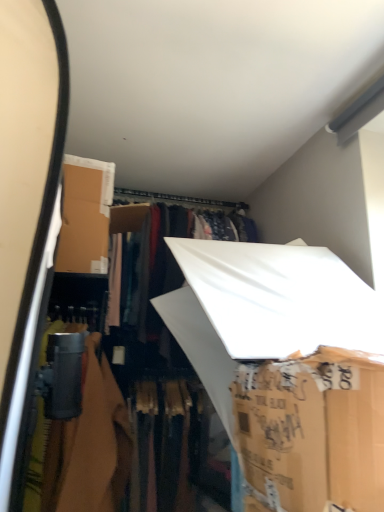
Question: Is white cardboard box at lower right, which is the first storage box in front-to-back order, placed right next to white cardboard box at center, which ranks as the 1th storage box in back-to-front order?

Choices:
 (A) no
 (B) yes

Answer: (A)

Question: Is white cardboard box at lower right, which is the first storage box in front-to-back order, smaller than white cardboard box at center, which is the 2th storage box from front to back?

Choices:
 (A) yes
 (B) no

Answer: (A)

Question: Is white cardboard box at center, which ranks as the 1th storage box in back-to-front order, completely or partially inside white cardboard box at lower right, which is the first storage box in front-to-back order?

Choices:
 (A) no
 (B) yes

Answer: (A)

Question: Considering the relative sizes of white cardboard box at lower right, acting as the 2th storage box starting from the back, and white cardboard box at center, which ranks as the 1th storage box in back-to-front order, in the image provided, is white cardboard box at lower right, acting as the 2th storage box starting from the back, taller than white cardboard box at center, which ranks as the 1th storage box in back-to-front order,?

Choices:
 (A) no
 (B) yes

Answer: (A)

Question: From a real-world perspective, is white cardboard box at lower right, which is the first storage box in front-to-back order, beneath white cardboard box at center, which is the 2th storage box from front to back?

Choices:
 (A) yes
 (B) no

Answer: (A)

Question: From the image's perspective, is white cardboard box at lower right, which is the first storage box in front-to-back order, beneath white cardboard box at center, which is the 2th storage box from front to back?

Choices:
 (A) no
 (B) yes

Answer: (B)

Question: Is white cardboard box at center, which is the 2th storage box from front to back, wider than white cardboard box at lower right, which is the first storage box in front-to-back order?

Choices:
 (A) yes
 (B) no

Answer: (A)

Question: Does white cardboard box at center, which is the 2th storage box from front to back, contain white cardboard box at lower right, acting as the 2th storage box starting from the back?

Choices:
 (A) yes
 (B) no

Answer: (B)

Question: Is white cardboard box at center, which is the 2th storage box from front to back, positioned with its back to white cardboard box at lower right, acting as the 2th storage box starting from the back?

Choices:
 (A) no
 (B) yes

Answer: (A)

Question: Can you confirm if white cardboard box at center, which is the 2th storage box from front to back, is shorter than white cardboard box at lower right, which is the first storage box in front-to-back order?

Choices:
 (A) yes
 (B) no

Answer: (B)

Question: Considering the relative positions of white cardboard box at center, which ranks as the 1th storage box in back-to-front order, and white cardboard box at lower right, acting as the 2th storage box starting from the back, in the image provided, is white cardboard box at center, which ranks as the 1th storage box in back-to-front order, to the right of white cardboard box at lower right, acting as the 2th storage box starting from the back, from the viewer's perspective?

Choices:
 (A) no
 (B) yes

Answer: (A)

Question: Is white cardboard box at center, which is the 2th storage box from front to back, positioned beyond the bounds of white cardboard box at lower right, which is the first storage box in front-to-back order?

Choices:
 (A) no
 (B) yes

Answer: (B)

Question: Considering the positions of white cardboard box at center, which is the 2th storage box from front to back, and white cardboard box at lower right, acting as the 2th storage box starting from the back, in the image, is white cardboard box at center, which is the 2th storage box from front to back, wider or thinner than white cardboard box at lower right, acting as the 2th storage box starting from the back,?

Choices:
 (A) thin
 (B) wide

Answer: (B)